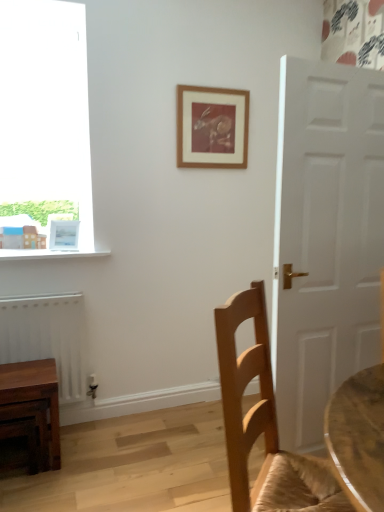
Question: Is point (54, 241) closer or farther from the camera than point (21, 297)?

Choices:
 (A) farther
 (B) closer

Answer: (A)

Question: From a real-world perspective, is white glossy picture frame at upper left, acting as the 1th picture frame starting from the left, above or below white matte radiator at lower left?

Choices:
 (A) below
 (B) above

Answer: (B)

Question: Estimate the real-world distances between objects in this image. Which object is closer to the wooden picture frame at upper center, which is counted as the 2th picture frame, starting from the bottom?

Choices:
 (A) light brown wood chair at right
 (B) white matte radiator at lower left
 (C) wooden table at lower left
 (D) white glossy picture frame at upper left, which appears as the 1th picture frame when ordered from the bottom

Answer: (D)

Question: Which of these objects is positioned farthest from the white matte radiator at lower left?

Choices:
 (A) light brown wood chair at right
 (B) wooden table at lower left
 (C) white glossy picture frame at upper left, acting as the 1th picture frame starting from the left
 (D) wooden picture frame at upper center, marked as the 2th picture frame in a left-to-right arrangement

Answer: (A)